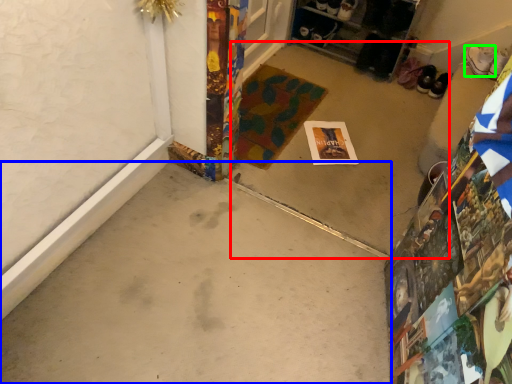
Question: Which is farther away from concrete (highlighted by a red box)? concrete (highlighted by a blue box) or footwear (highlighted by a green box)?

Choices:
 (A) concrete
 (B) footwear

Answer: (B)